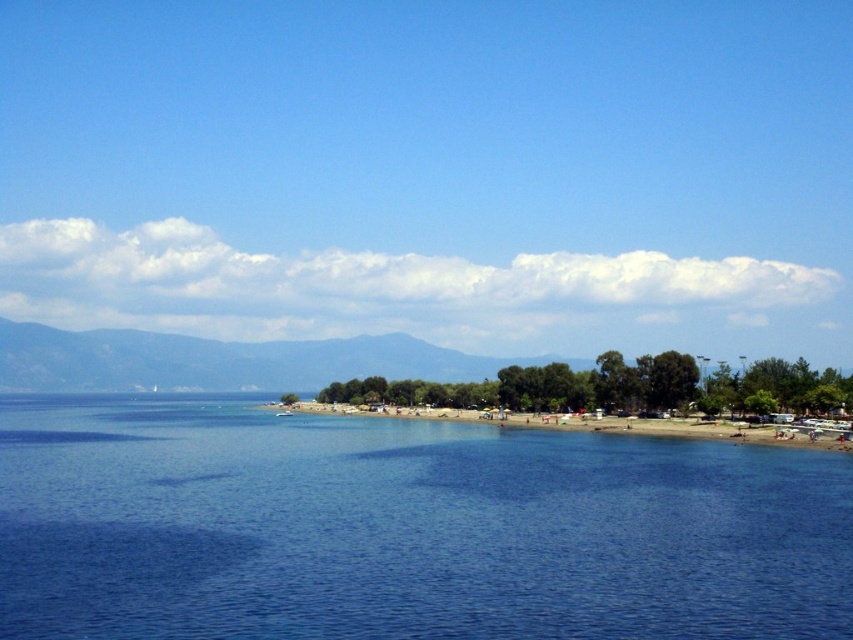
You are standing on the beach and want to take a photo of both the blue water at center and the green leafy mountain at center. Which object should you focus on first to ensure both are in sharp focus?

You should focus on the green leafy mountain at center first because it is farther away than the blue water at center. By focusing on the distant object, you can ensure that the closer object will also be in focus due to the depth of field.

You are a photographer planning to capture the entire scene in one shot. Given that the blue water at center and the green leafy mountain at center are both in focus, which object will appear smaller in the photograph?

The blue water at center will appear smaller in the photograph because it occupies less space than the green leafy mountain at center according to the description.